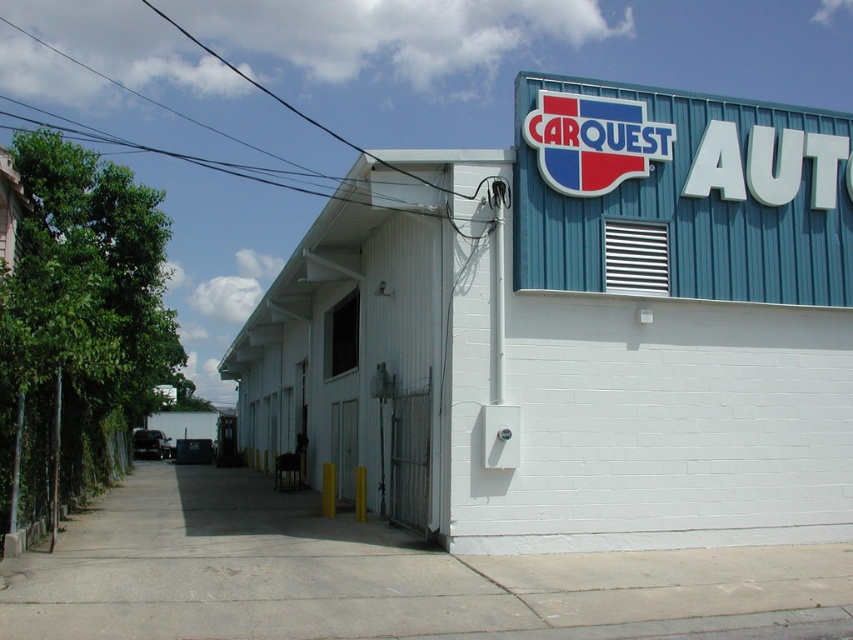
Is white brick building at center below blue corrugated metal sign at upper right?

Correct, white brick building at center is located below blue corrugated metal sign at upper right.

How much distance is there between white brick building at center and blue corrugated metal sign at upper right?

The distance of white brick building at center from blue corrugated metal sign at upper right is 8.90 meters.

Where is `white brick building at center`? This screenshot has width=853, height=640. white brick building at center is located at coordinates (578, 326).